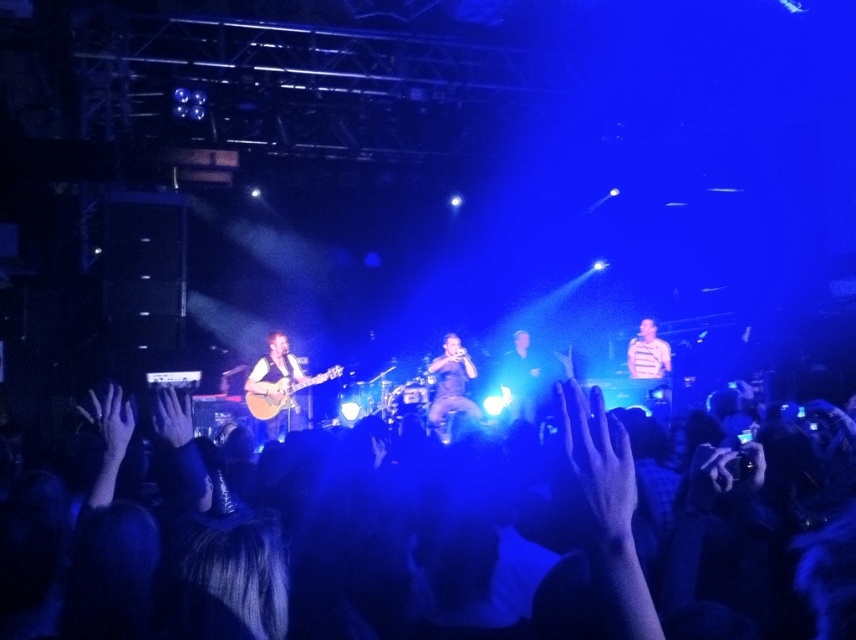
You are a photographer at the concert and want to capture a photo that includes both the drummer and the guitarist. The drummer is at point (128,602) and the guitarist is at point (514,406). Based on their positions, which musician is closer to the camera?

The drummer at point (128,602) is closer to the camera because point (128,602) is in front of point (514,406).

You are a concert attendee standing in the front row. You want to know where the shiny black microphone at center is located in the image. Please provide its coordinates as a point in the format of x,y.

The shiny black microphone at center is located at coordinates (450, 385).